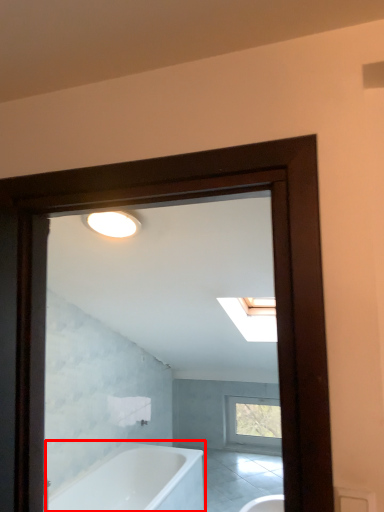
Question: From the image's perspective, what is the correct spatial relationship of bathtub (annotated by the red box) in relation to window?

Choices:
 (A) below
 (B) above

Answer: (B)